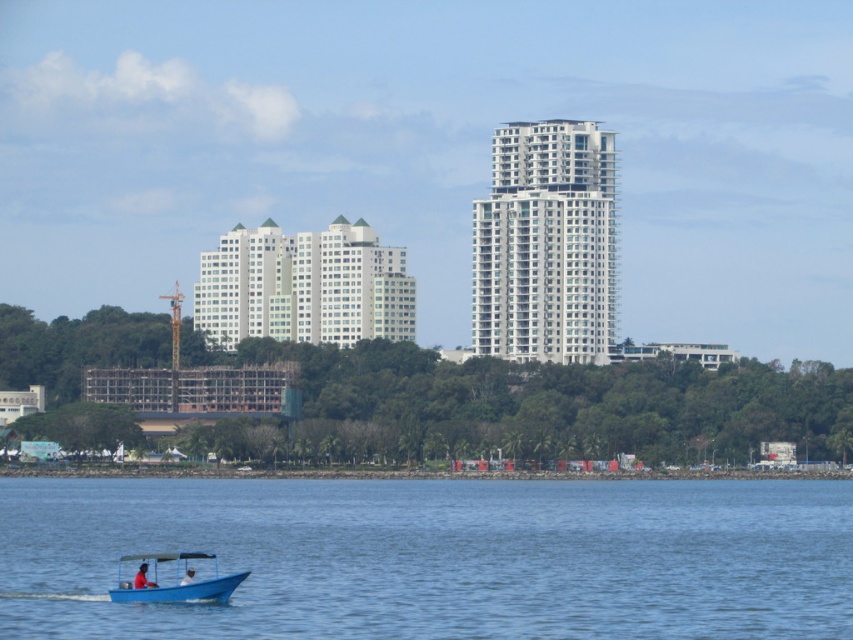
Question: Does blue water at lower left lie in front of blue plastic boat at lower left?

Choices:
 (A) no
 (B) yes

Answer: (B)

Question: Can you confirm if blue water at lower left is wider than blue plastic boat at lower left?

Choices:
 (A) no
 (B) yes

Answer: (B)

Question: Considering the relative positions of blue water at lower left and blue plastic boat at lower left in the image provided, where is blue water at lower left located with respect to blue plastic boat at lower left?

Choices:
 (A) left
 (B) right

Answer: (B)

Question: Among these objects, which one is nearest to the camera?

Choices:
 (A) blue water at lower left
 (B) blue plastic boat at lower left

Answer: (A)